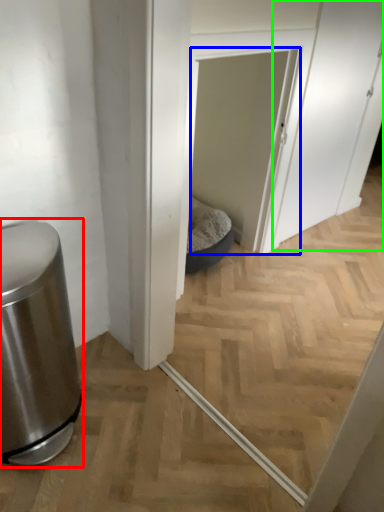
Question: Which object is positioned farthest from waste container (highlighted by a red box)? Select from screen door (highlighted by a blue box) and screen door (highlighted by a green box).

Choices:
 (A) screen door
 (B) screen door

Answer: (B)